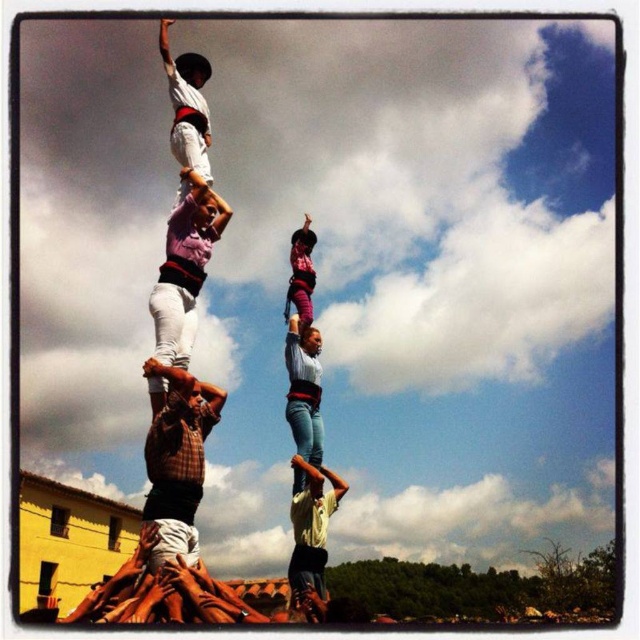
Question: Can you confirm if light yellow shirt at center is positioned above blue jeans at center?

Choices:
 (A) yes
 (B) no

Answer: (B)

Question: Can you confirm if plaid shirt at center is positioned to the right of white cotton shirt at center?

Choices:
 (A) no
 (B) yes

Answer: (B)

Question: Which of the following is the farthest from the observer?

Choices:
 (A) blue jeans at center
 (B) plaid shirt at center
 (C) white cotton shirt at upper center

Answer: (A)

Question: Which of the following is the closest to the observer?

Choices:
 (A) plaid shirt at center
 (B) pink fabric at center
 (C) white cotton shirt at center
 (D) white cotton shirt at upper center

Answer: (A)

Question: Which object appears farthest from the camera in this image?

Choices:
 (A) plaid shirt at center
 (B) white cotton shirt at center

Answer: (B)

Question: Is plaid shirt at center to the left of light yellow shirt at center from the viewer's perspective?

Choices:
 (A) yes
 (B) no

Answer: (A)